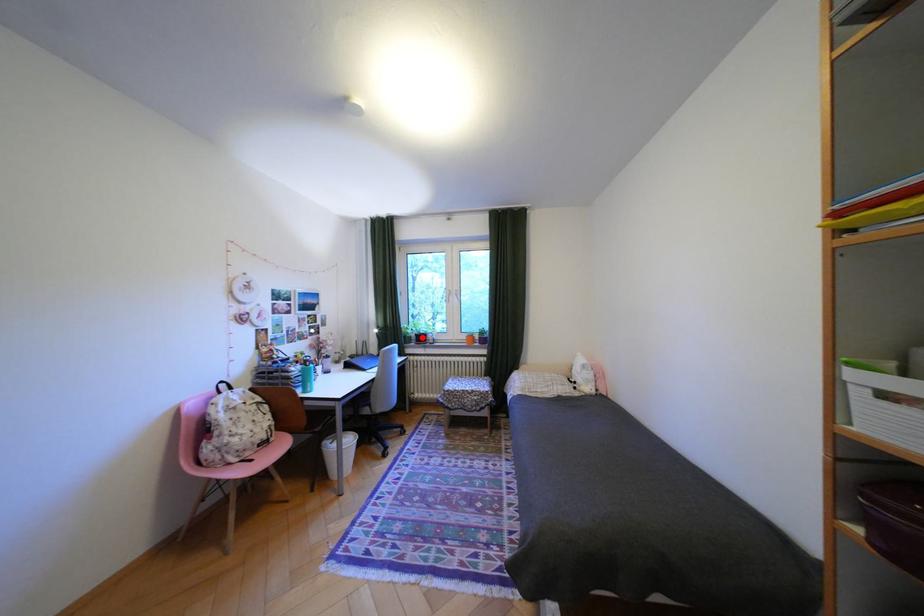
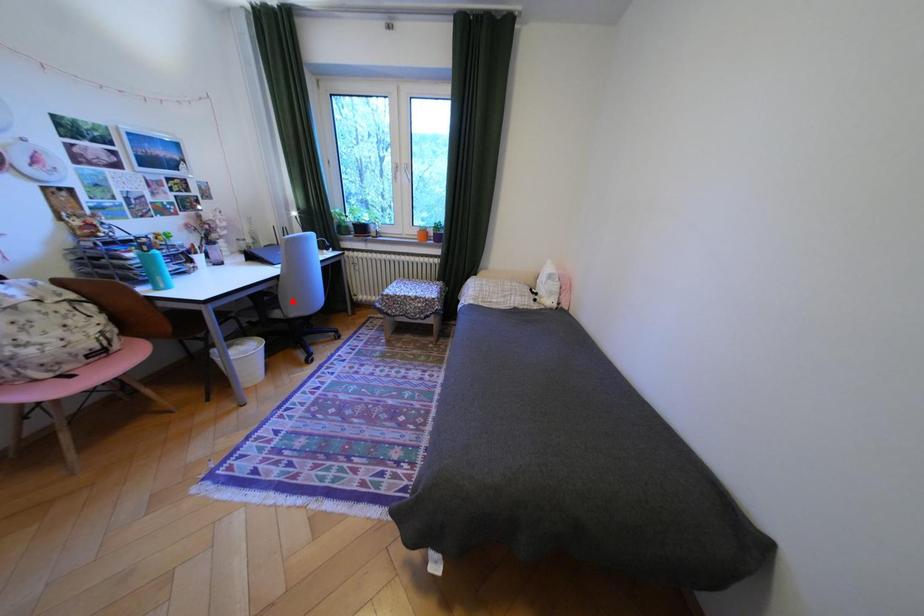
I am providing you with two images of the same scene from different viewpoints. A red point is marked on the first image and another point is marked on the second image. Does the point marked in image1 correspond to the same location as the one in image2?

No